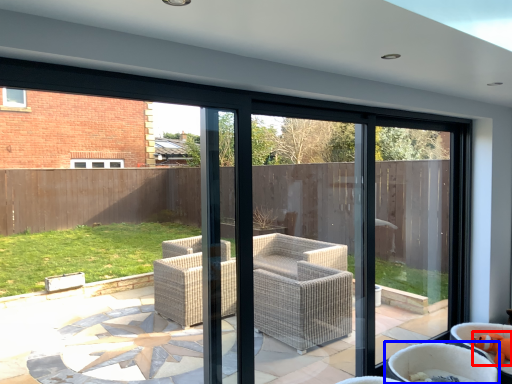
Question: Which of the following is the closest to the observer, toy (highlighted by a red box) or chair (highlighted by a blue box)?

Choices:
 (A) toy
 (B) chair

Answer: (B)